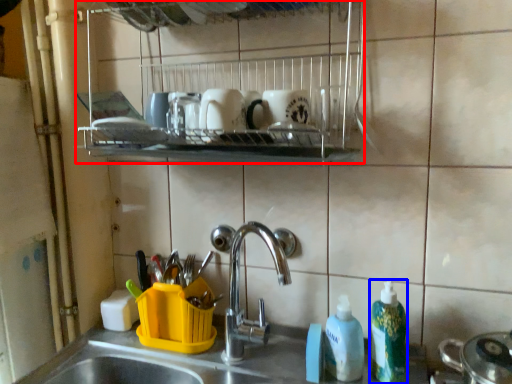
Question: Which object appears farthest to the camera in this image, shelf (highlighted by a red box) or cleaning product (highlighted by a blue box)?

Choices:
 (A) shelf
 (B) cleaning product

Answer: (B)